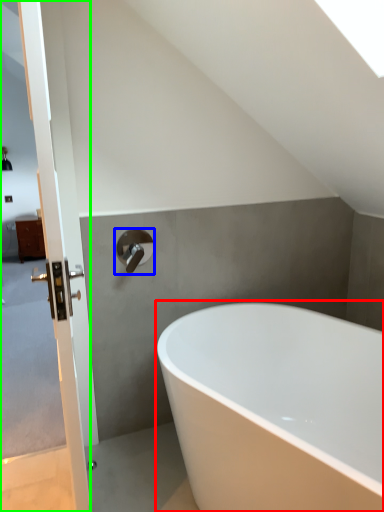
Question: Which object is positioned closest to bathtub (highlighted by a red box)? Select from tap (highlighted by a blue box) and screen door (highlighted by a green box).

Choices:
 (A) tap
 (B) screen door

Answer: (A)